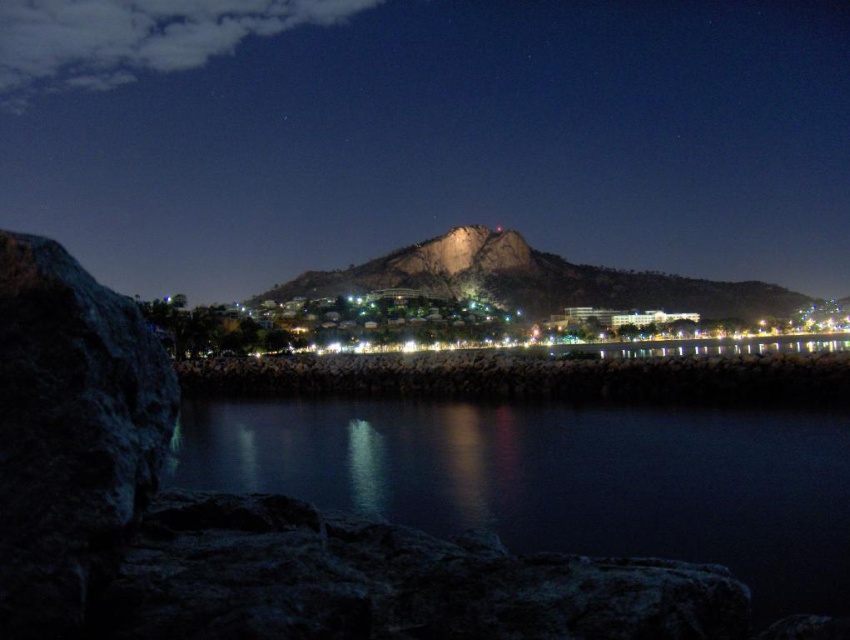
You are a drone operator who needs to fly a drone from the smooth dark water at center to the rocky brown mountain at center. What is the minimum distance the drone must travel?

The smooth dark water at center and rocky brown mountain at center are 89.17 meters apart, so the minimum distance the drone must travel is 89.17 meters.

You are standing on the rocky shoreline in the foreground of the coastal scene. You want to climb up to the rocky cliff at left marked by point (428, 132). Is the cliff accessible from your current position?

The point (428, 132) marks the rocky cliff at left, so yes, the cliff is accessible from your current position on the rocky shoreline since it is part of the same rocky terrain.